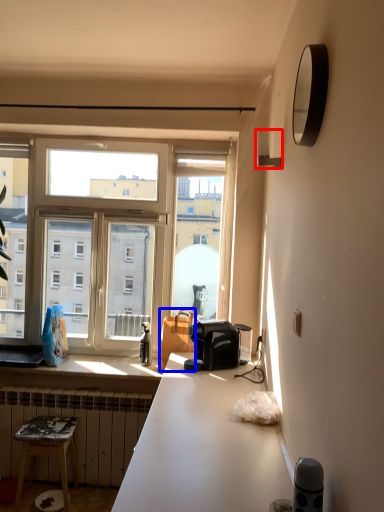
Question: Which point is further to the camera, lamp (highlighted by a red box) or handbag (highlighted by a blue box)?

Choices:
 (A) lamp
 (B) handbag

Answer: (B)